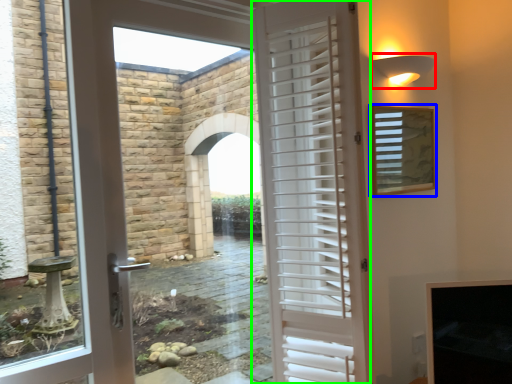
Question: Estimate the real-world distances between objects in this image. Which object is farther from light fixture (highlighted by a red box), window screen (highlighted by a blue box) or door (highlighted by a green box)?

Choices:
 (A) window screen
 (B) door

Answer: (B)